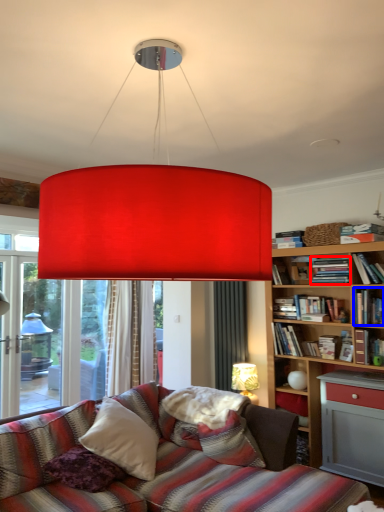
Question: Among these objects, which one is nearest to the camera, book (highlighted by a red box) or book (highlighted by a blue box)?

Choices:
 (A) book
 (B) book

Answer: (B)